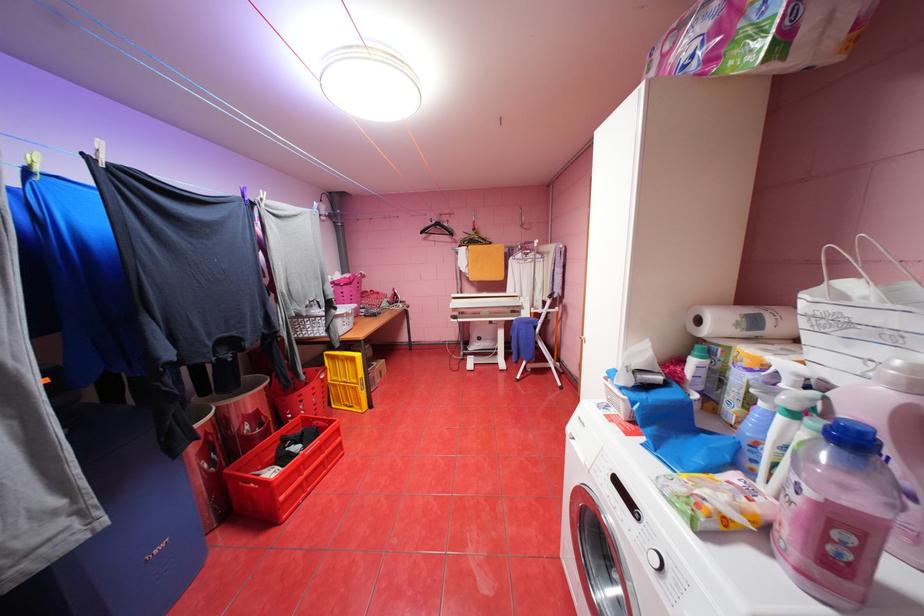
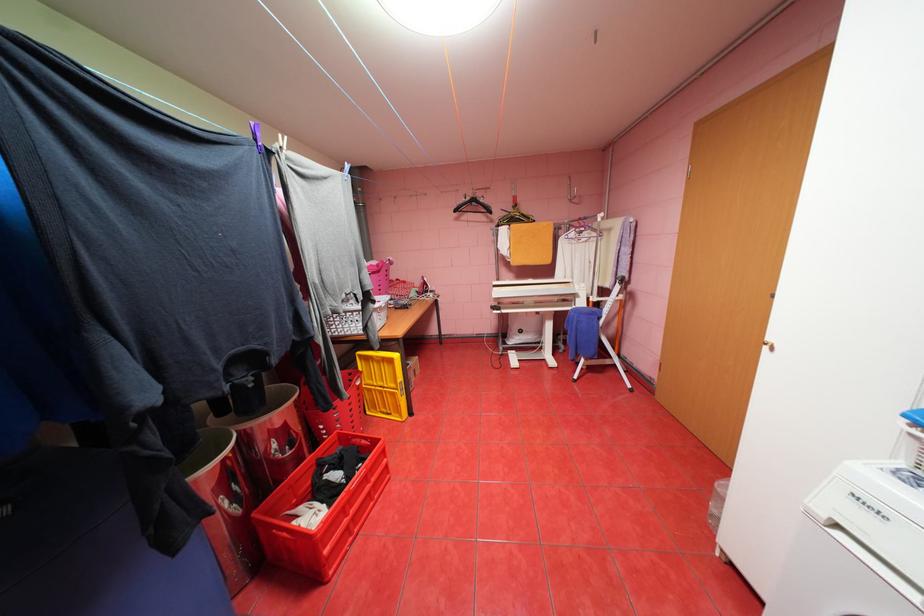
Where in the second image is the point corresponding to (431,232) from the first image?

(464, 209)